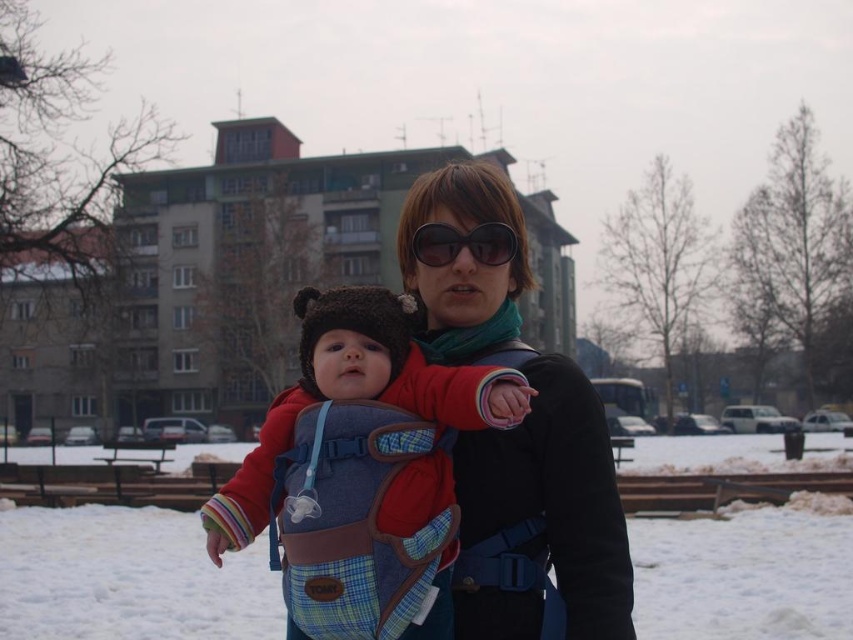
Can you confirm if white fluffy snow at center is wider than black plastic sunglasses at center?

Yes, white fluffy snow at center is wider than black plastic sunglasses at center.

What are the coordinates of `white fluffy snow at center` in the screenshot? It's located at tap(128, 579).

Can you confirm if plaid fabric baby carrier at center is wider than black plastic sunglasses at center?

Correct, the width of plaid fabric baby carrier at center exceeds that of black plastic sunglasses at center.

The image size is (853, 640). What do you see at coordinates (361, 472) in the screenshot? I see `plaid fabric baby carrier at center` at bounding box center [361, 472].

Image resolution: width=853 pixels, height=640 pixels. Find the location of `plaid fabric baby carrier at center`. plaid fabric baby carrier at center is located at coordinates (361, 472).

Is the position of matte black jacket at center less distant than that of black plastic sunglasses at center?

Yes.

Based on the photo, who is taller, matte black jacket at center or black plastic sunglasses at center?

Standing taller between the two is matte black jacket at center.

Where is `matte black jacket at center`? matte black jacket at center is located at coordinates (518, 440).